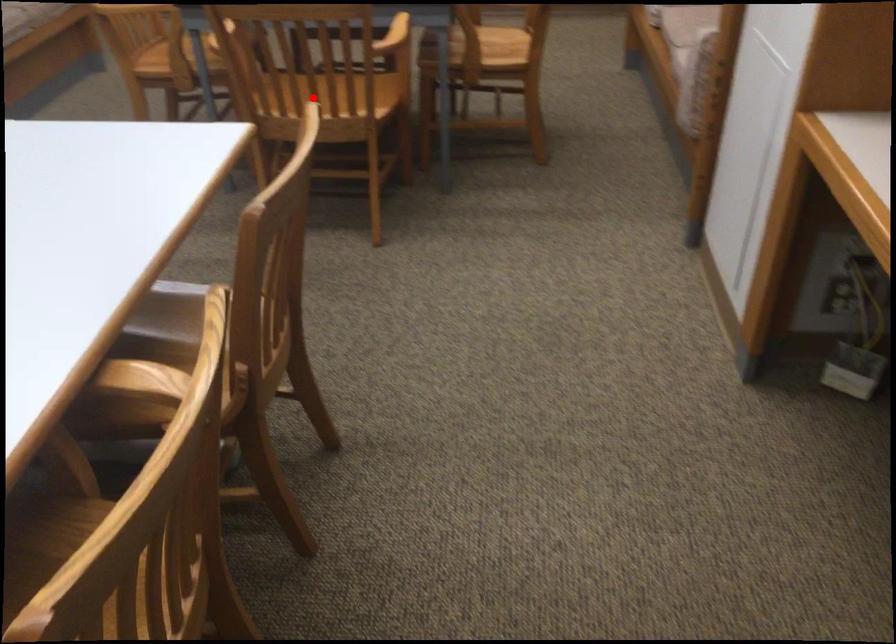
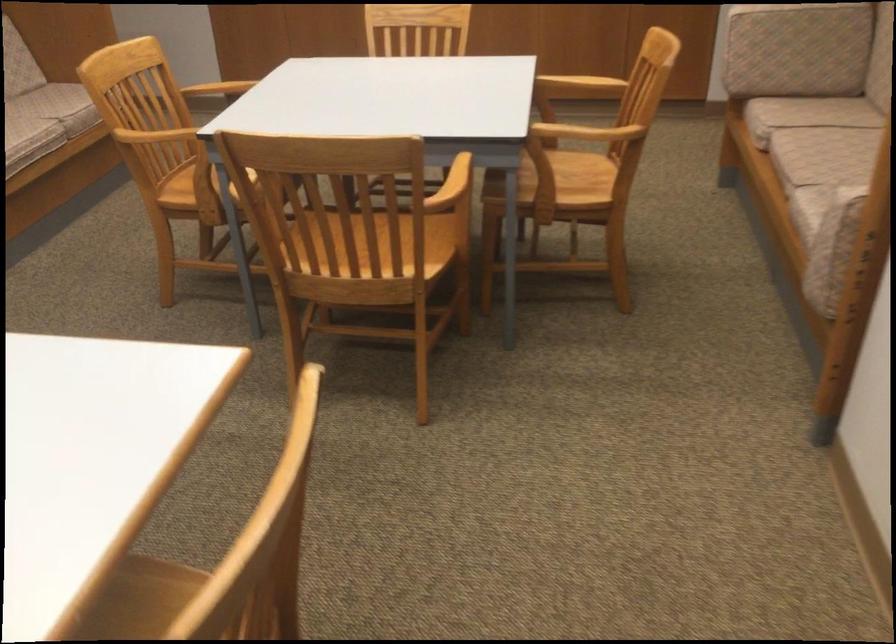
Question: I am providing you with two images of the same scene from different viewpoints. A red point is shown in image1. For the corresponding object point in image2, is it positioned nearer or farther from the camera?

Choices:
 (A) Nearer
 (B) Farther

Answer: (A)